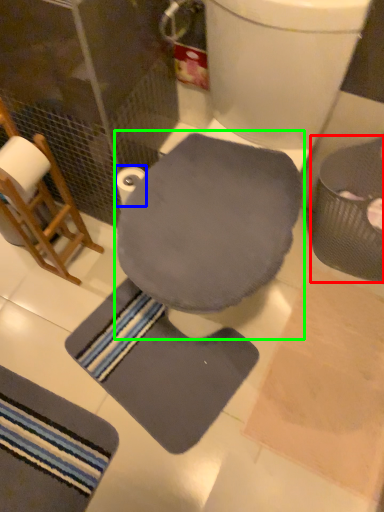
Question: Which object is positioned farthest from potty (highlighted by a red box)? Select from toilet paper (highlighted by a blue box) and swivel chair (highlighted by a green box).

Choices:
 (A) toilet paper
 (B) swivel chair

Answer: (A)